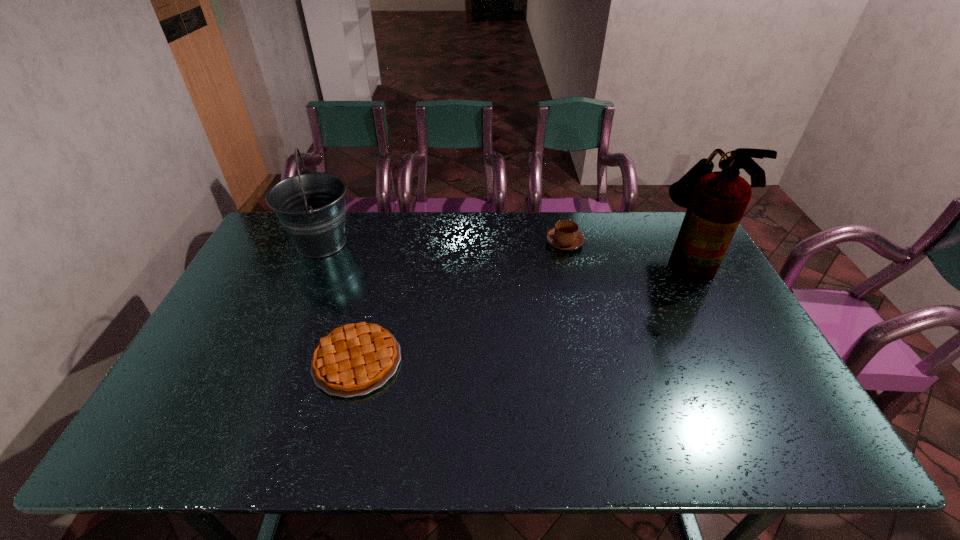
The width and height of the screenshot is (960, 540). I want to click on free space at the far edge of the desktop, so click(x=511, y=230).

Locate an element on the screen. The height and width of the screenshot is (540, 960). blank space at the near edge is located at coordinates (247, 440).

Identify the location of vacant space at the left edge of the desktop. (190, 363).

Locate an element on the screen. blank space at the right edge of the desktop is located at coordinates (722, 315).

Find the location of a particular element. The height and width of the screenshot is (540, 960). free spot at the far right corner of the desktop is located at coordinates (662, 228).

Identify the location of vacant space that's between the cappuccino and the tallest object. (625, 250).

The image size is (960, 540). I want to click on free area in between the cappuccino and the rightmost object, so click(x=625, y=250).

At what (x,y) coordinates should I click in order to perform the action: click on vacant region between the tallest object and the cappuccino. Please return your answer as a coordinate pair (x, y). Looking at the image, I should click on (625, 250).

Locate an element on the screen. empty space that is in between the bucket and the third object from left to right is located at coordinates (444, 242).

What are the coordinates of `vacant area between the fire extinguisher and the second tallest object` in the screenshot? It's located at (504, 251).